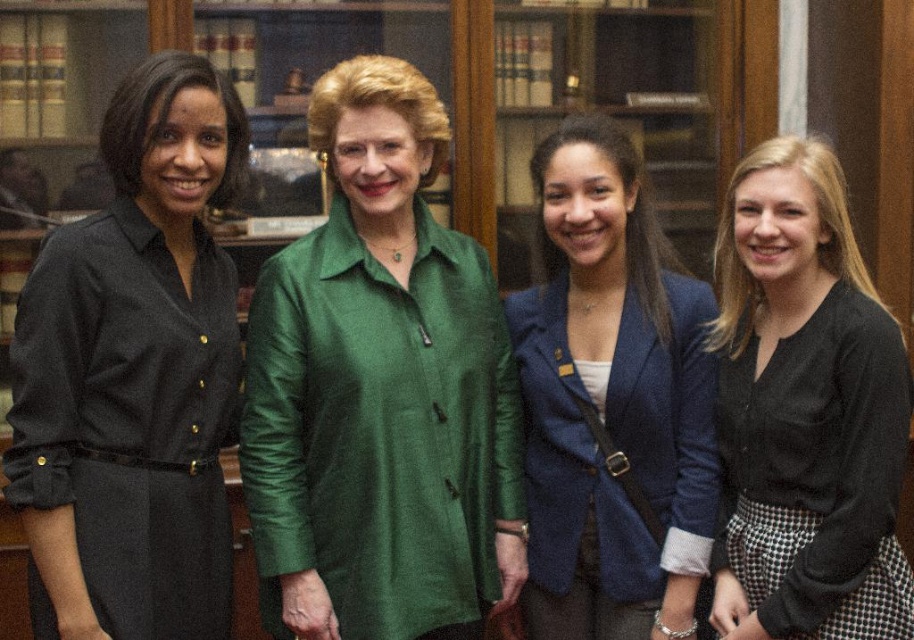
You are standing in the library and need to pass between the black dress at left and the blue textured blazer at center. If your width is 20 inches, can you fit through the space between them?

The distance between the black dress at left and the blue textured blazer at center is 30.96 inches. Since your width is 20 inches, you can fit through the space as there is enough room.